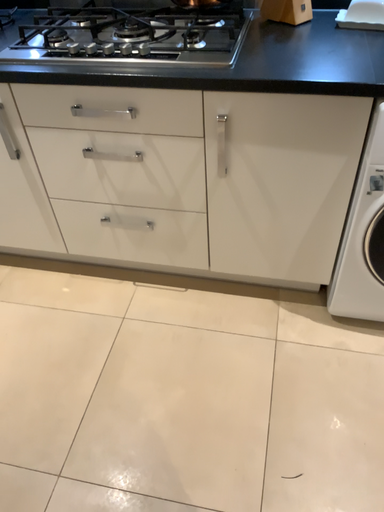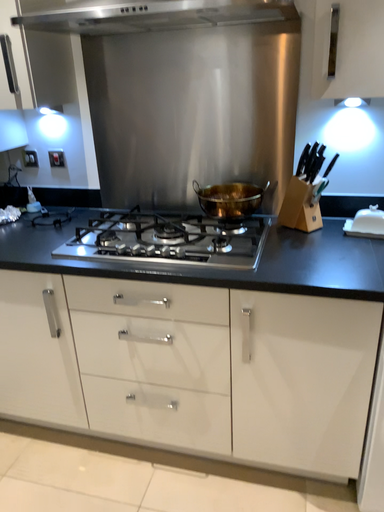
Question: How did the camera likely rotate when shooting the video?

Choices:
 (A) rotated upward
 (B) rotated downward

Answer: (A)